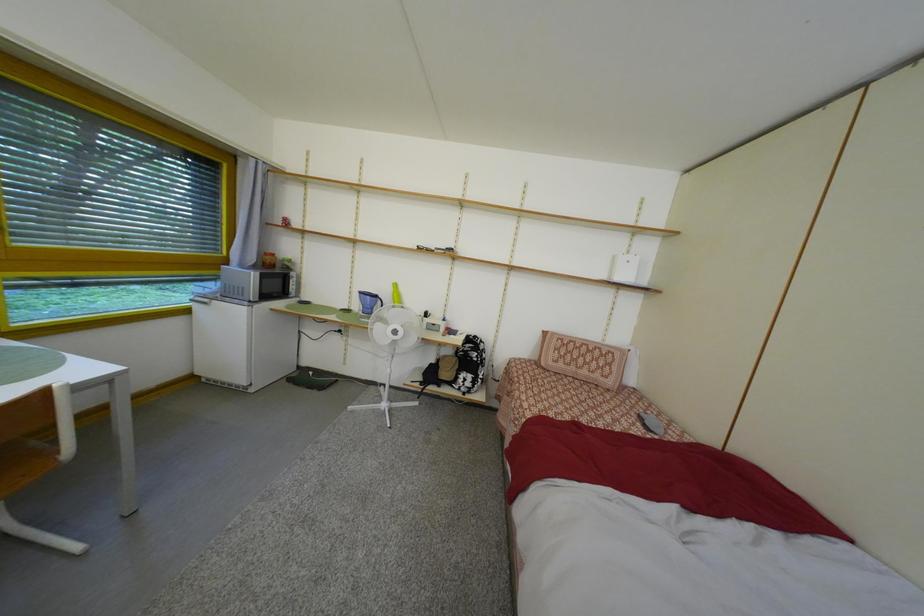
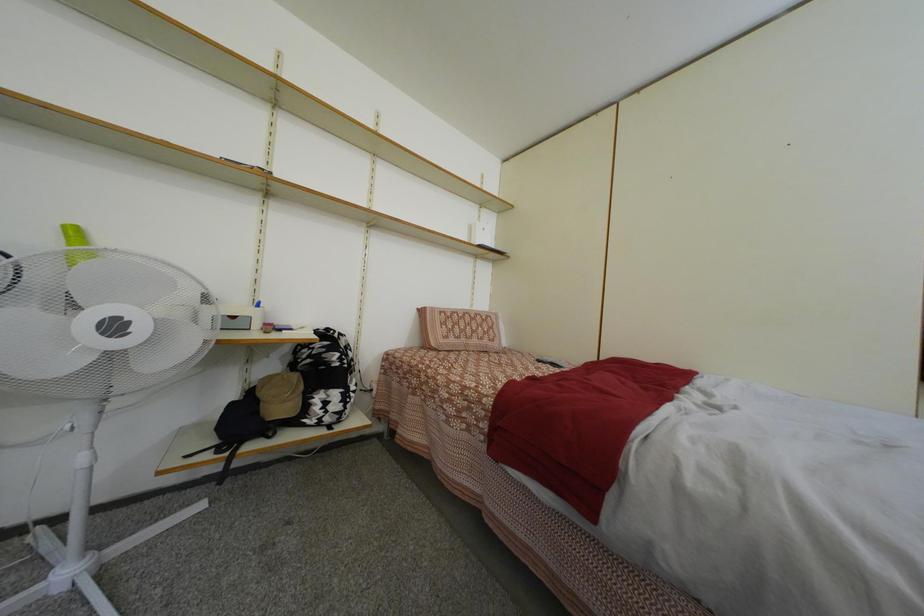
Question: The camera is either moving clockwise (left) or counter-clockwise (right) around the object. The first image is from the beginning of the video and the second image is from the end. Is the camera moving left or right when shooting the video?

Choices:
 (A) Left
 (B) Right

Answer: (A)